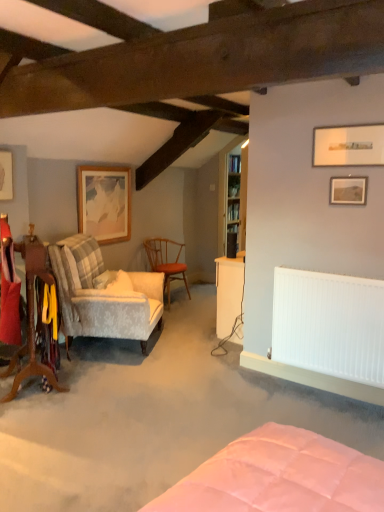
The image size is (384, 512). I want to click on matte white picture frame at upper left, which is the 3th picture frame from front to back, so click(6, 175).

Find the location of a particular element. The height and width of the screenshot is (512, 384). wooden textured chair at center, positioned as the 3th chair in front-to-back order is located at coordinates (166, 262).

Locate an element on the screen. white smooth radiator at right is located at coordinates (329, 324).

Where is `chair behind the wooden framed artwork at upper left, which ranks as the second picture frame in left-to-right order`? chair behind the wooden framed artwork at upper left, which ranks as the second picture frame in left-to-right order is located at coordinates (166, 262).

In terms of size, does wooden framed artwork at upper left, which ranks as the second picture frame in left-to-right order, appear bigger or smaller than wooden textured chair at center, positioned as the 3th chair in front-to-back order?

Clearly, wooden framed artwork at upper left, which ranks as the second picture frame in left-to-right order, is smaller in size than wooden textured chair at center, positioned as the 3th chair in front-to-back order.

From the image's perspective, is wooden framed artwork at upper left, which ranks as the 1th picture frame in back-to-front order, below wooden textured chair at center, positioned as the 3th chair in front-to-back order?

No, from the image's perspective, wooden framed artwork at upper left, which ranks as the 1th picture frame in back-to-front order, is not below wooden textured chair at center, positioned as the 3th chair in front-to-back order.

Does wooden framed artwork at upper left, the fourth picture frame when ordered from front to back, appear on the right side of wooden textured chair at center, positioned as the 3th chair in front-to-back order?

No, wooden framed artwork at upper left, the fourth picture frame when ordered from front to back, is not to the right of wooden textured chair at center, positioned as the 3th chair in front-to-back order.

Measure the distance from white smooth radiator at right to wooden textured chair at center, positioned as the 3th chair in front-to-back order.

They are 6.82 feet apart.

Considering the relative positions of white smooth radiator at right and wooden textured chair at center, arranged as the first chair when viewed from the back, in the image provided, is white smooth radiator at right to the right of wooden textured chair at center, arranged as the first chair when viewed from the back, from the viewer's perspective?

Yes, white smooth radiator at right is to the right of wooden textured chair at center, arranged as the first chair when viewed from the back.

From the image's perspective, is white smooth radiator at right above or below wooden textured chair at center, positioned as the 3th chair in front-to-back order?

Based on their image positions, white smooth radiator at right is located beneath wooden textured chair at center, positioned as the 3th chair in front-to-back order.

Considering the sizes of objects matte white picture frame at upper right, the third picture frame in the left-to-right sequence, and white smooth radiator at right in the image provided, who is shorter, matte white picture frame at upper right, the third picture frame in the left-to-right sequence, or white smooth radiator at right?

matte white picture frame at upper right, the third picture frame in the left-to-right sequence, is shorter.

Between matte white picture frame at upper right, the third picture frame in the left-to-right sequence, and white smooth radiator at right, which one has larger size?

white smooth radiator at right.

Locate an element on the screen. radiator below the matte white picture frame at upper right, which is counted as the fourth picture frame, starting from the back (from the image's perspective) is located at coordinates (329, 324).

Does wooden plaid chair at left, which appears as the third chair when viewed from the back, have a lesser height compared to wooden textured chair at center, positioned as the 3th chair in front-to-back order?

No.

Can you confirm if wooden plaid chair at left, marked as the first chair in a front-to-back arrangement, is wider than wooden textured chair at center, arranged as the first chair when viewed from the back?

Incorrect, the width of wooden plaid chair at left, marked as the first chair in a front-to-back arrangement, does not surpass that of wooden textured chair at center, arranged as the first chair when viewed from the back.

Would you say wooden plaid chair at left, marked as the first chair in a front-to-back arrangement, contains wooden textured chair at center, arranged as the first chair when viewed from the back?

Actually, wooden textured chair at center, arranged as the first chair when viewed from the back, is outside wooden plaid chair at left, marked as the first chair in a front-to-back arrangement.

From the image's perspective, which one is positioned higher, wooden plaid chair at left, which appears as the third chair when viewed from the back, or wooden textured chair at center, arranged as the first chair when viewed from the back?

wooden textured chair at center, arranged as the first chair when viewed from the back, is shown above in the image.

Considering the sizes of objects matte wooden picture frame at upper right, the 3th picture frame positioned from the back, and matte white picture frame at upper left, marked as the 2th picture frame in a back-to-front arrangement, in the image provided, who is shorter, matte wooden picture frame at upper right, the 3th picture frame positioned from the back, or matte white picture frame at upper left, marked as the 2th picture frame in a back-to-front arrangement,?

matte wooden picture frame at upper right, the 3th picture frame positioned from the back.

Looking at this image, from the image's perspective, which is below, matte wooden picture frame at upper right, marked as the 2th picture frame in a front-to-back arrangement, or matte white picture frame at upper left, marked as the 2th picture frame in a back-to-front arrangement?

matte wooden picture frame at upper right, marked as the 2th picture frame in a front-to-back arrangement.

Measure the distance between matte wooden picture frame at upper right, the 3th picture frame positioned from the back, and matte white picture frame at upper left, which is the 3th picture frame from front to back.

A distance of 8.15 feet exists between matte wooden picture frame at upper right, the 3th picture frame positioned from the back, and matte white picture frame at upper left, which is the 3th picture frame from front to back.

From a real-world perspective, is velvet-patterned armchair at left, the second chair when ordered from front to back, on top of wooden framed artwork at upper left, the third picture frame when ordered from right to left?

Actually, velvet-patterned armchair at left, the second chair when ordered from front to back, is physically below wooden framed artwork at upper left, the third picture frame when ordered from right to left, in the real world.

Is velvet-patterned armchair at left, which is the second chair from back to front, looking in the opposite direction of wooden framed artwork at upper left, which ranks as the 1th picture frame in back-to-front order?

No, velvet-patterned armchair at left, which is the second chair from back to front, is not facing the opposite direction of wooden framed artwork at upper left, which ranks as the 1th picture frame in back-to-front order.

Is velvet-patterned armchair at left, the second chair when ordered from front to back, next to wooden framed artwork at upper left, which ranks as the 1th picture frame in back-to-front order?

velvet-patterned armchair at left, the second chair when ordered from front to back, and wooden framed artwork at upper left, which ranks as the 1th picture frame in back-to-front order, are not in contact.

In the scene shown: Between matte wooden picture frame at upper right, which appears as the 1th picture frame when viewed from the right, and white smooth radiator at right, which one has larger size?

white smooth radiator at right.

Which is in front, point (341, 188) or point (274, 345)?

The point (341, 188) is closer.

Is the surface of matte wooden picture frame at upper right, which ranks as the 4th picture frame in left-to-right order, in direct contact with white smooth radiator at right?

There is a gap between matte wooden picture frame at upper right, which ranks as the 4th picture frame in left-to-right order, and white smooth radiator at right.

Is matte wooden picture frame at upper right, marked as the 2th picture frame in a front-to-back arrangement, not inside white smooth radiator at right?

That's correct, matte wooden picture frame at upper right, marked as the 2th picture frame in a front-to-back arrangement, is outside of white smooth radiator at right.

From the image's perspective, count 2nd picture frames upward from the wooden textured chair at center, arranged as the first chair when viewed from the back, and point to it. Please provide its 2D coordinates.

[(104, 203)]

Which chair is the 2nd one when counting from the back of the white smooth radiator at right? Please provide its 2D coordinates.

[(166, 262)]

Considering their positions, is white smooth radiator at right positioned closer to wooden bookshelf at upper center than wooden plaid chair at left, which appears as the third chair when viewed from the back?

white smooth radiator at right lies closer to wooden bookshelf at upper center than the other object.

When comparing their distances from matte white picture frame at upper right, the first picture frame when ordered from front to back, does wooden framed artwork at upper left, the third picture frame when ordered from right to left, or wooden plaid chair at left, marked as the first chair in a front-to-back arrangement, seem further?

Based on the image, wooden framed artwork at upper left, the third picture frame when ordered from right to left, appears to be further to matte white picture frame at upper right, the first picture frame when ordered from front to back.

Looking at the image, which one is located further to white smooth radiator at right, wooden textured chair at center, arranged as the first chair when viewed from the back, or white soft pillow at left?

wooden textured chair at center, arranged as the first chair when viewed from the back, lies further to white smooth radiator at right than the other object.

Estimate the real-world distances between objects in this image. Which object is further from matte wooden picture frame at upper right, which ranks as the 4th picture frame in left-to-right order, matte white picture frame at upper left, marked as the 2th picture frame in a back-to-front arrangement, or white soft pillow at left?

Among the two, matte white picture frame at upper left, marked as the 2th picture frame in a back-to-front arrangement, is located further to matte wooden picture frame at upper right, which ranks as the 4th picture frame in left-to-right order.

Based on their spatial positions, is matte wooden picture frame at upper right, marked as the 2th picture frame in a front-to-back arrangement, or matte white picture frame at upper left, positioned as the 4th picture frame in right-to-left order, further from velvet-patterned armchair at left, the second chair when ordered from front to back?

The object further to velvet-patterned armchair at left, the second chair when ordered from front to back, is matte wooden picture frame at upper right, marked as the 2th picture frame in a front-to-back arrangement.

When comparing their distances from matte white picture frame at upper right, which is counted as the fourth picture frame, starting from the back, does wooden plaid chair at left, which appears as the third chair when viewed from the back, or white soft pillow at left seem closer?

Among the two, white soft pillow at left is located nearer to matte white picture frame at upper right, which is counted as the fourth picture frame, starting from the back.

From the image, which object appears to be farther from white soft pillow at left, white smooth radiator at right or matte white picture frame at upper right, the first picture frame when ordered from front to back?

matte white picture frame at upper right, the first picture frame when ordered from front to back.

From the picture: Estimate the real-world distances between objects in this image. Which object is closer to white soft pillow at left, wooden plaid chair at left, marked as the first chair in a front-to-back arrangement, or matte white picture frame at upper right, which is the 2th picture frame from right to left?

wooden plaid chair at left, marked as the first chair in a front-to-back arrangement, is closer to white soft pillow at left.

At what (x,y) coordinates should I click in order to perform the action: click on pillow located between matte wooden picture frame at upper right, marked as the 2th picture frame in a front-to-back arrangement, and wooden bookshelf at upper center in the depth direction. Please return your answer as a coordinate pair (x, y). The width and height of the screenshot is (384, 512). Looking at the image, I should click on (120, 283).

The height and width of the screenshot is (512, 384). Find the location of `pillow situated between wooden framed artwork at upper left, the fourth picture frame when ordered from front to back, and matte white picture frame at upper right, the first picture frame when ordered from front to back, from left to right`. pillow situated between wooden framed artwork at upper left, the fourth picture frame when ordered from front to back, and matte white picture frame at upper right, the first picture frame when ordered from front to back, from left to right is located at coordinates (120, 283).

Identify the location of radiator between white soft pillow at left and matte white picture frame at upper right, which is the 2th picture frame from right to left, in the horizontal direction. The height and width of the screenshot is (512, 384). (329, 324).

The width and height of the screenshot is (384, 512). Find the location of `chair between wooden plaid chair at left, which appears as the third chair when viewed from the back, and wooden framed artwork at upper left, which ranks as the 1th picture frame in back-to-front order, along the z-axis`. chair between wooden plaid chair at left, which appears as the third chair when viewed from the back, and wooden framed artwork at upper left, which ranks as the 1th picture frame in back-to-front order, along the z-axis is located at coordinates (103, 294).